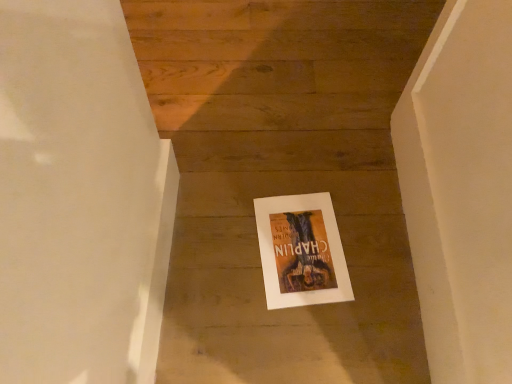
Identify the location of vacant space to the right of white paper at center. The width and height of the screenshot is (512, 384). (374, 249).